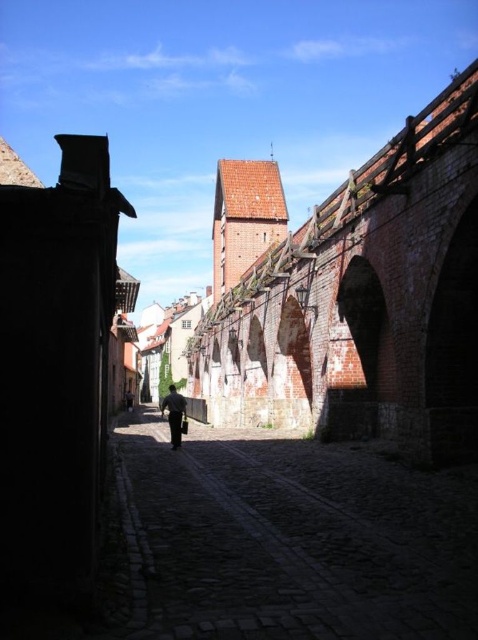
Can you confirm if dark cobblestone path at center is bigger than dark blue fabric at center?

Incorrect, dark cobblestone path at center is not larger than dark blue fabric at center.

Which is below, dark cobblestone path at center or dark blue fabric at center?

dark blue fabric at center

Which is behind, point (283, 484) or point (130, 401)?

The point (130, 401) is behind.

Locate an element on the screen. The width and height of the screenshot is (478, 640). dark cobblestone path at center is located at coordinates (295, 540).

Who is shorter, dark gray fabric pants at center or dark blue fabric at center?

Standing shorter between the two is dark blue fabric at center.

The width and height of the screenshot is (478, 640). I want to click on dark gray fabric pants at center, so click(x=173, y=413).

Who is positioned more to the left, dark cobblestone path at center or dark gray fabric pants at center?

dark gray fabric pants at center is more to the left.

Who is more distant from viewer, (173, 465) or (165, 404)?

Point (165, 404)

In the scene shown: Who is more distant from viewer, (336, 630) or (172, 442)?

The point (172, 442) is more distant.

I want to click on dark cobblestone path at center, so click(x=295, y=540).